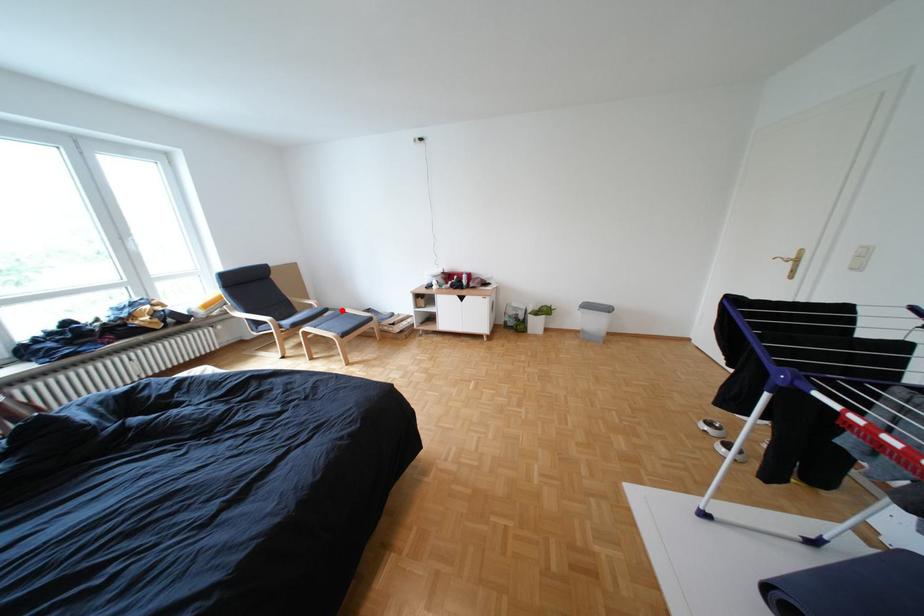
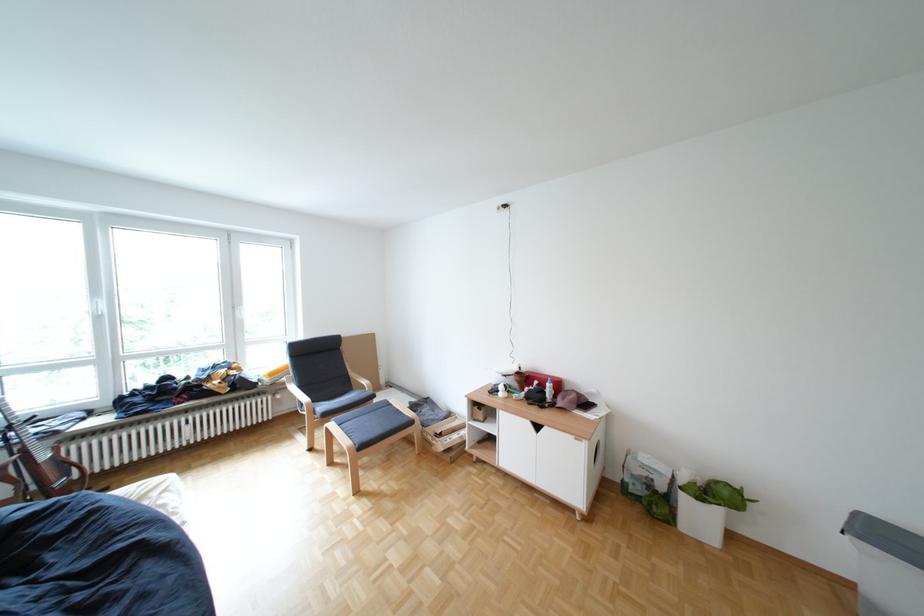
Find the pixel in the second image that matches the highlighted location in the first image.

(388, 397)